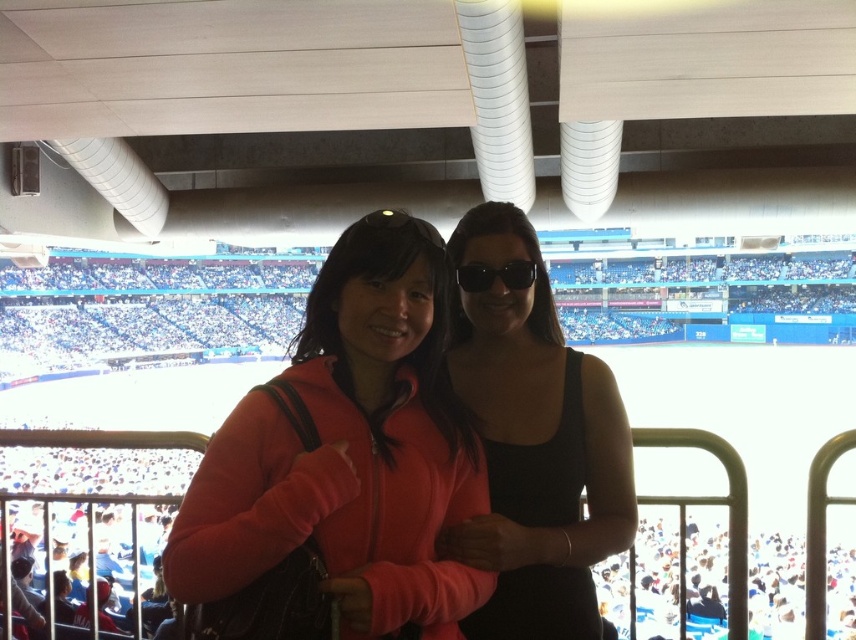
Question: Is matte orange jacket at center positioned in front of black matte tank top at center?

Choices:
 (A) no
 (B) yes

Answer: (A)

Question: Can you confirm if matte orange jacket at center is positioned to the left of black matte tank top at center?

Choices:
 (A) yes
 (B) no

Answer: (A)

Question: From the image, what is the correct spatial relationship of matte orange jacket at center in relation to black matte tank top at center?

Choices:
 (A) below
 (B) above

Answer: (A)

Question: Which of the following is the closest to the observer?

Choices:
 (A) black matte tank top at center
 (B) matte orange jacket at center

Answer: (A)

Question: Which object appears farthest from the camera in this image?

Choices:
 (A) black matte tank top at center
 (B) matte orange jacket at center

Answer: (B)